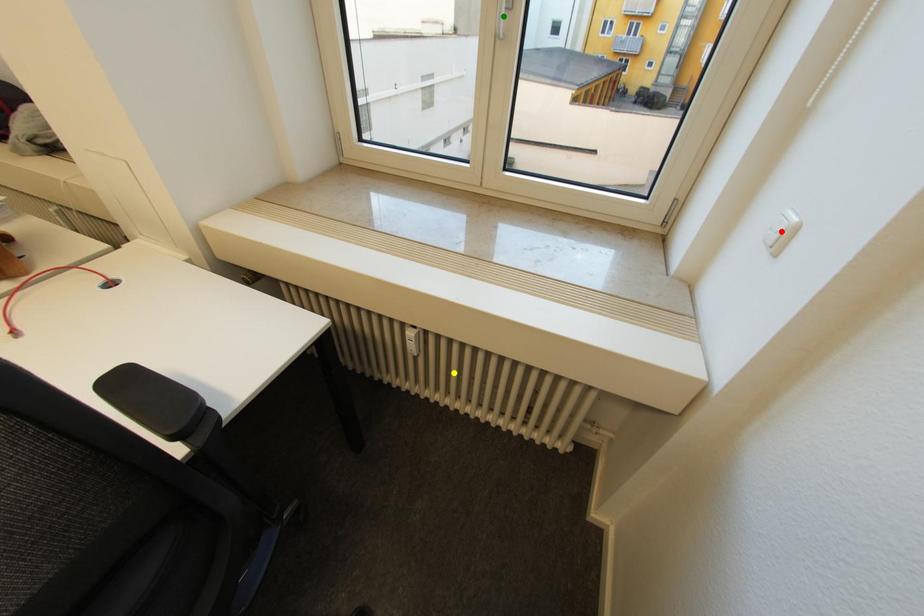
Order these from farthest to nearest:
yellow point | red point | green point

yellow point, green point, red point